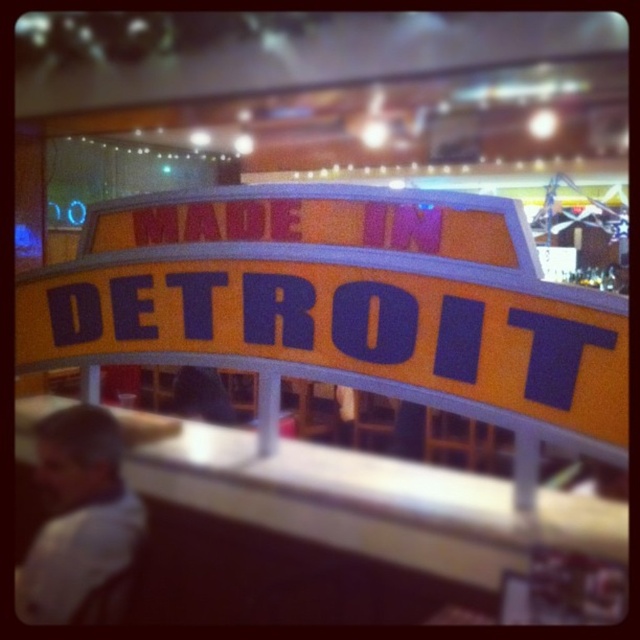
Question: Which object appears farthest from the camera in this image?

Choices:
 (A) white shirt at lower left
 (B) yellow matte sign at center

Answer: (A)

Question: Is yellow matte sign at center below white shirt at lower left?

Choices:
 (A) no
 (B) yes

Answer: (A)

Question: Among these points, which one is farthest from the camera?

Choices:
 (A) (228, 268)
 (B) (45, 465)

Answer: (B)

Question: Is yellow matte sign at center in front of white shirt at lower left?

Choices:
 (A) no
 (B) yes

Answer: (B)

Question: Is yellow matte sign at center to the left of white shirt at lower left from the viewer's perspective?

Choices:
 (A) no
 (B) yes

Answer: (A)

Question: Which object is closer to the camera taking this photo?

Choices:
 (A) white shirt at lower left
 (B) yellow matte sign at center

Answer: (B)